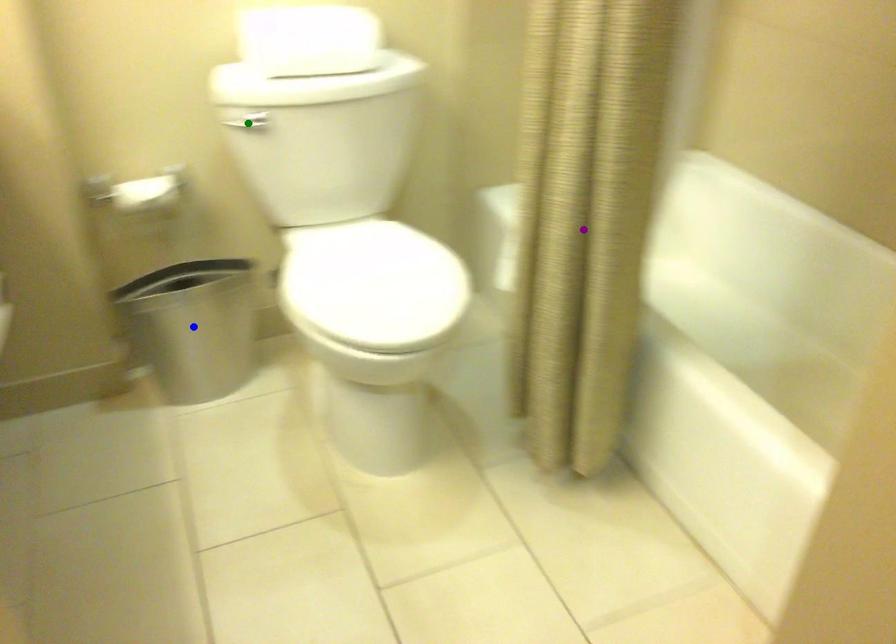
Order these from farthest to nearest:
blue point, green point, purple point

1. blue point
2. green point
3. purple point